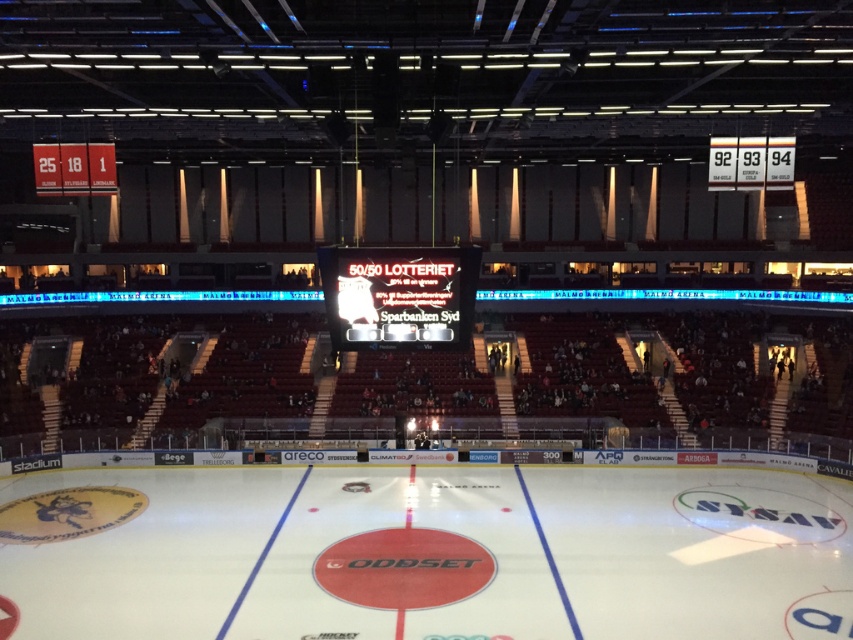
Who is more forward, (x=20, y=497) or (x=334, y=253)?

Point (x=334, y=253) is more forward.

Between white smooth ice at center and black glossy scoreboard at center, which one has less height?

Standing shorter between the two is white smooth ice at center.

Where is `white smooth ice at center`? The width and height of the screenshot is (853, 640). white smooth ice at center is located at coordinates (434, 554).

Where is `white smooth ice at center`? white smooth ice at center is located at coordinates (434, 554).